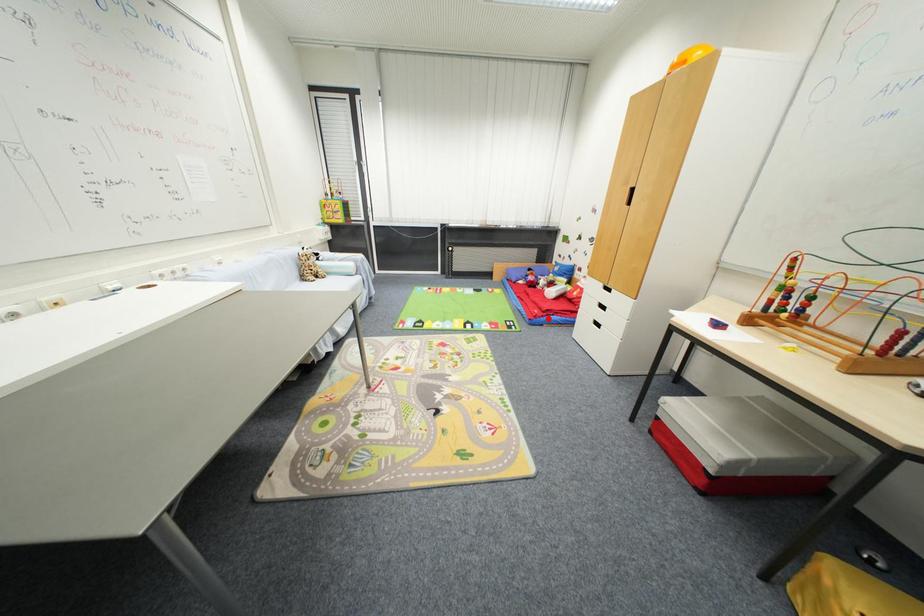
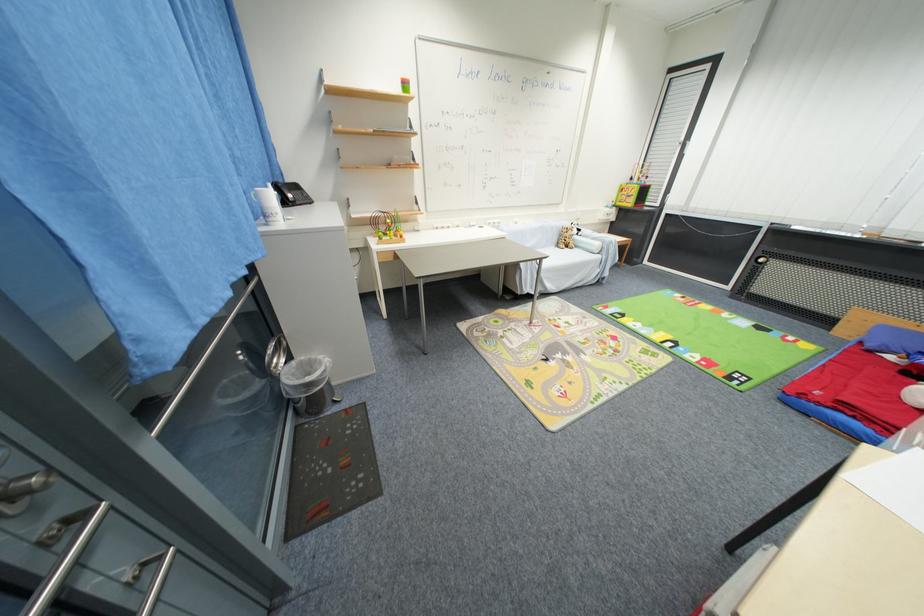
Find the pixel in the second image that matches the highlighted location in the first image.

(824, 406)